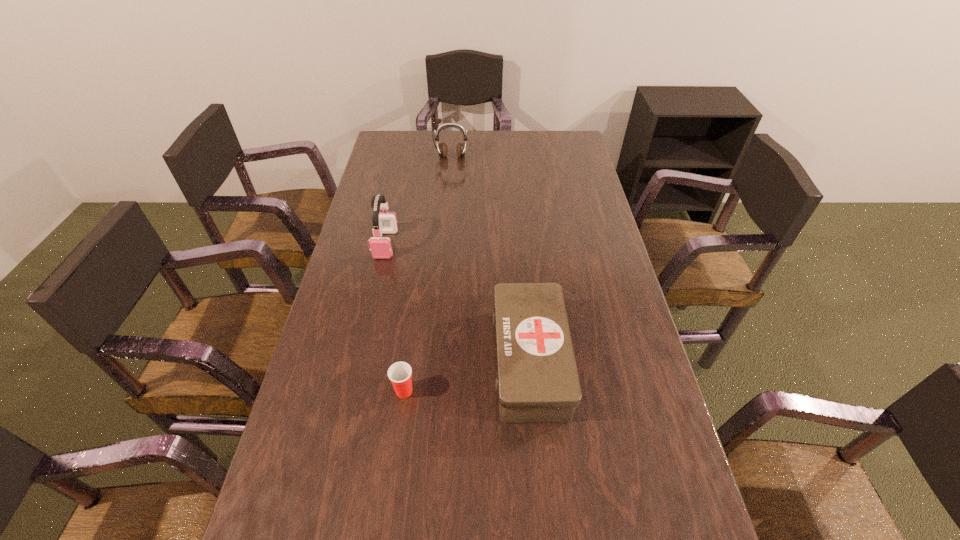
I want to click on empty space that is in between the right earphone and the shortest object, so click(x=428, y=274).

This screenshot has width=960, height=540. Identify the location of blank region between the farther earphone and the shortest object. (428, 274).

I want to click on empty location between the shortest object and the right earphone, so click(x=428, y=274).

At what (x,y) coordinates should I click in order to perform the action: click on free space between the leftmost object and the right earphone. Please return your answer as a coordinate pair (x, y). This screenshot has height=540, width=960. Looking at the image, I should click on (419, 200).

Select which object appears as the third closest to the right earphone. Please provide its 2D coordinates. Your answer should be formatted as a tuple, i.e. [(x, y)], where the tuple contains the x and y coordinates of a point satisfying the conditions above.

[(399, 373)]

Image resolution: width=960 pixels, height=540 pixels. I want to click on object that can be found as the closest to the shortest object, so click(x=537, y=380).

Identify the location of free space that satisfies the following two spatial constraints: 1. on the ear pads of the rightmost object; 2. on the left side of the farthest object. This screenshot has height=540, width=960. (434, 361).